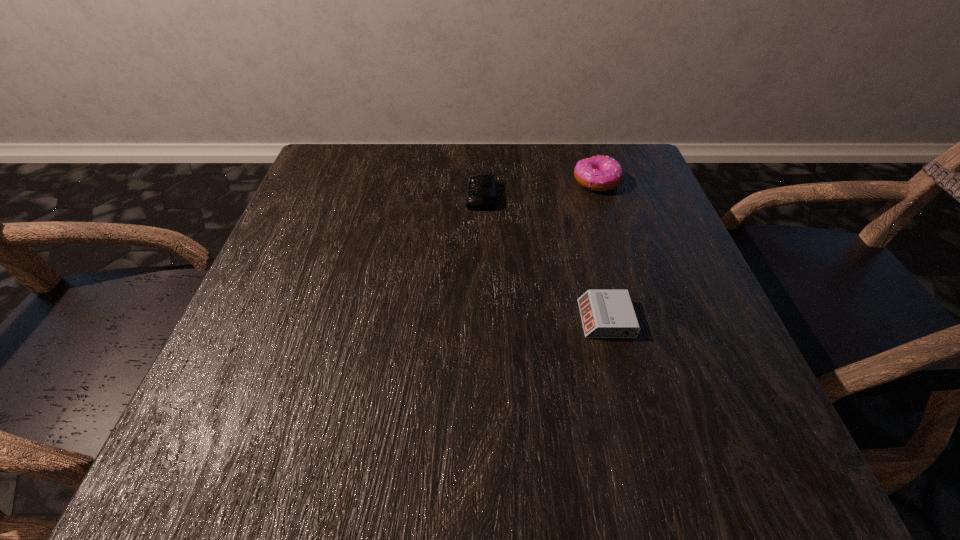
The height and width of the screenshot is (540, 960). What are the coordinates of `the tallest object` in the screenshot? It's located at (601, 173).

Locate an element on the screen. the nearer alarm clock is located at coordinates (605, 313).

Find the location of a particular element. The height and width of the screenshot is (540, 960). the nearest object is located at coordinates (605, 313).

Where is `the left alarm clock`? The image size is (960, 540). the left alarm clock is located at coordinates (480, 194).

At what (x,y) coordinates should I click in order to perform the action: click on the leftmost object. Please return your answer as a coordinate pair (x, y). This screenshot has height=540, width=960. Looking at the image, I should click on (480, 194).

Image resolution: width=960 pixels, height=540 pixels. I want to click on vacant space located 0.190m on the left of the doughnut, so tap(490, 181).

What are the coordinates of `vacant region located on the back of the nearest object` in the screenshot? It's located at (583, 227).

The height and width of the screenshot is (540, 960). I want to click on vacant region located on the display of the farther alarm clock, so click(x=311, y=196).

You are a GUI agent. You are given a task and a screenshot of the screen. Output one action in this format:
    pyautogui.click(x=<x>, y=<y>)
    Task: Click on the free space located 0.240m on the display of the farther alarm clock
    This screenshot has width=960, height=540.
    Given the screenshot: What is the action you would take?
    pyautogui.click(x=356, y=196)

Image resolution: width=960 pixels, height=540 pixels. What are the coordinates of `blank area located 0.130m on the display of the farther alarm clock` in the screenshot? It's located at (406, 196).